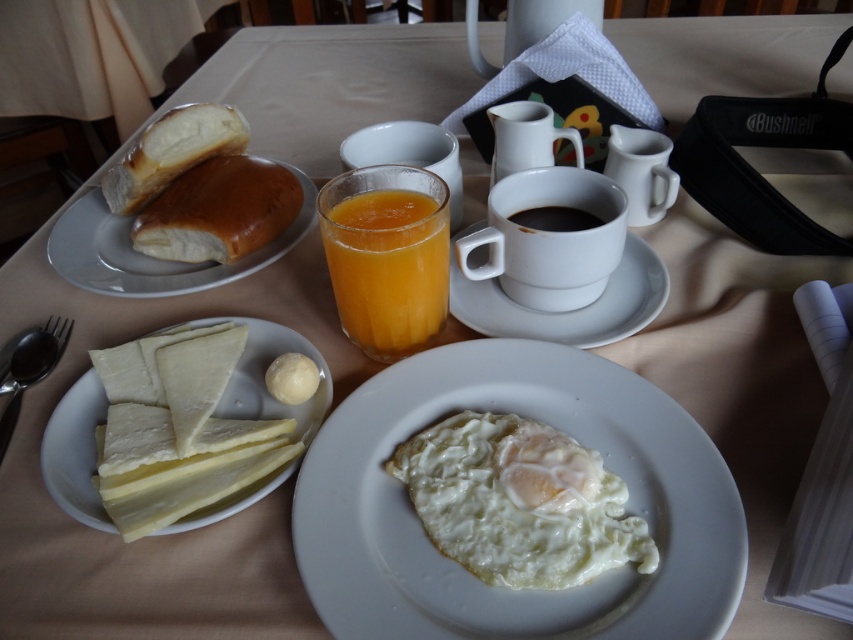
Question: Does white glossy plate at upper left come behind black matte cup at upper center?

Choices:
 (A) yes
 (B) no

Answer: (A)

Question: Which object is the closest to the black matte cup at upper center?

Choices:
 (A) golden brown crusty bread at upper left
 (B) translucent glass orange juice at center
 (C) white ceramic cup at upper center
 (D) white glossy plate at center

Answer: (C)

Question: Estimate the real-world distances between objects in this image. Which object is farther from the matte brown bread at upper left?

Choices:
 (A) white cheese at lower left
 (B) translucent glass orange juice at center
 (C) white smooth egg at center
 (D) black matte cup at upper center

Answer: (D)

Question: Can you confirm if translucent glass orange juice at center is thinner than matte brown bread at upper left?

Choices:
 (A) yes
 (B) no

Answer: (A)

Question: Does white glossy plate at center appear on the left side of white glossy plate at upper left?

Choices:
 (A) no
 (B) yes

Answer: (A)

Question: Which point is farther to the camera?

Choices:
 (A) white cheese at lower left
 (B) white smooth egg at center

Answer: (B)